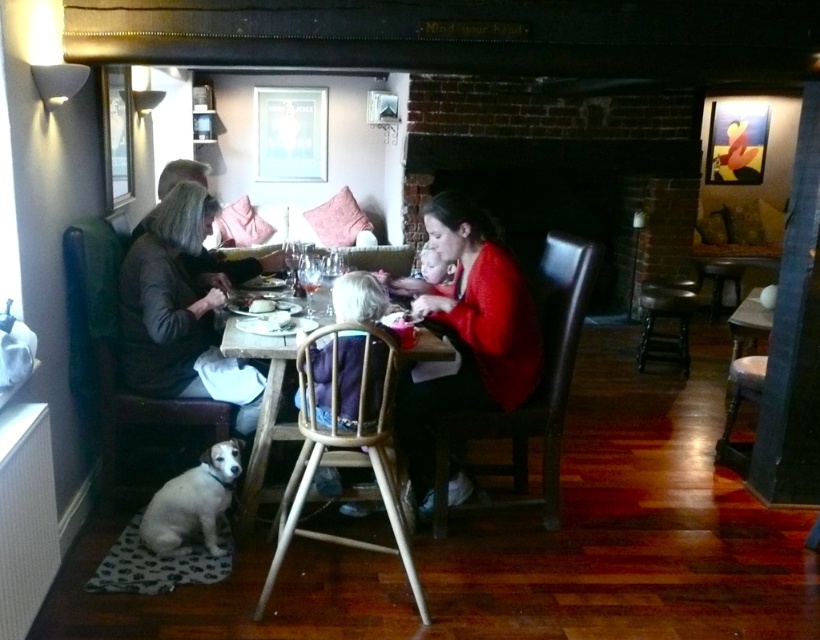
Can you confirm if red matte sweater at center is positioned to the left of metallic stool at center right?

Yes, red matte sweater at center is to the left of metallic stool at center right.

Is point (445, 316) in front of point (680, 356)?

Yes, point (445, 316) is closer to viewer.

Is point (526, 394) farther from camera compared to point (657, 284)?

No, (526, 394) is closer to viewer.

Locate an element on the screen. The width and height of the screenshot is (820, 640). red matte sweater at center is located at coordinates (467, 333).

Which of these two, matte black high chair at center or metallic stool at center right, stands shorter?

Standing shorter between the two is metallic stool at center right.

Between point (408, 417) and point (688, 300), which one is positioned behind?

The point (688, 300) is more distant.

The width and height of the screenshot is (820, 640). Identify the location of matte black high chair at center. (467, 328).

Which is more to the left, dark gray sweater at left or metallic stool at center right?

dark gray sweater at left

Is dark gray sweater at left in front of metallic stool at center right?

Yes, it is.

What do you see at coordinates (169, 296) in the screenshot? This screenshot has height=640, width=820. I see `dark gray sweater at left` at bounding box center [169, 296].

This screenshot has width=820, height=640. What are the coordinates of `dark gray sweater at left` in the screenshot? It's located at (169, 296).